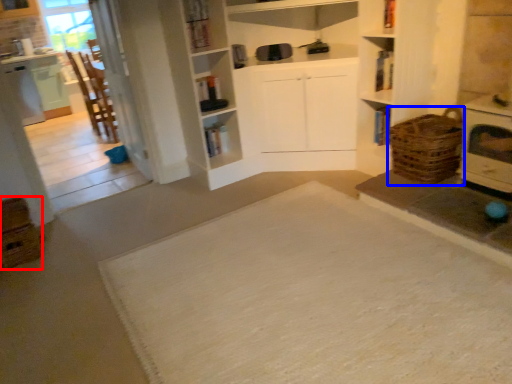
Question: Among these objects, which one is nearest to the camera, crate (highlighted by a red box) or basket (highlighted by a blue box)?

Choices:
 (A) crate
 (B) basket

Answer: (A)